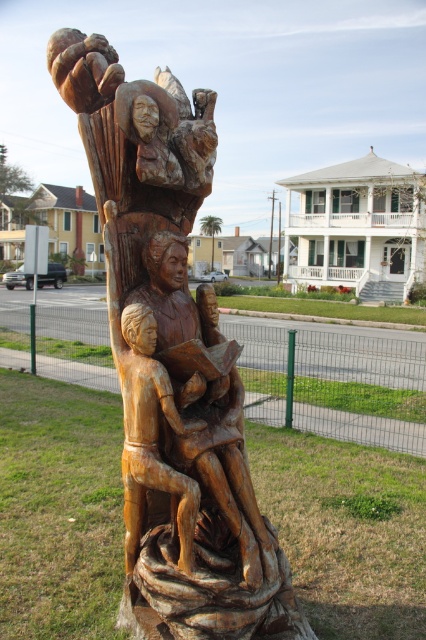
Does wooden carving at center have a greater width compared to light brown wood carving of person at center?

Yes, wooden carving at center is wider than light brown wood carving of person at center.

The image size is (426, 640). In order to click on wooden carving at center in this screenshot , I will do `click(204, 400)`.

Does natural wood carving at center come behind light brown wood carving of person at center?

No, natural wood carving at center is closer to the viewer.

Does natural wood carving at center have a greater height compared to light brown wood carving of person at center?

Yes, natural wood carving at center is taller than light brown wood carving of person at center.

This screenshot has width=426, height=640. Describe the element at coordinates (172, 364) in the screenshot. I see `natural wood carving at center` at that location.

Where is `natural wood carving at center`? The height and width of the screenshot is (640, 426). natural wood carving at center is located at coordinates (172, 364).

Where is `natural wood carving at center`? This screenshot has width=426, height=640. natural wood carving at center is located at coordinates (172, 364).

Between natural wood carving at center and wooden carving at center, which one appears on the right side from the viewer's perspective?

Positioned to the right is wooden carving at center.

Does point (98, 198) come behind point (219, 392)?

That is True.

Locate an element on the screen. Image resolution: width=426 pixels, height=640 pixels. natural wood carving at center is located at coordinates (172, 364).